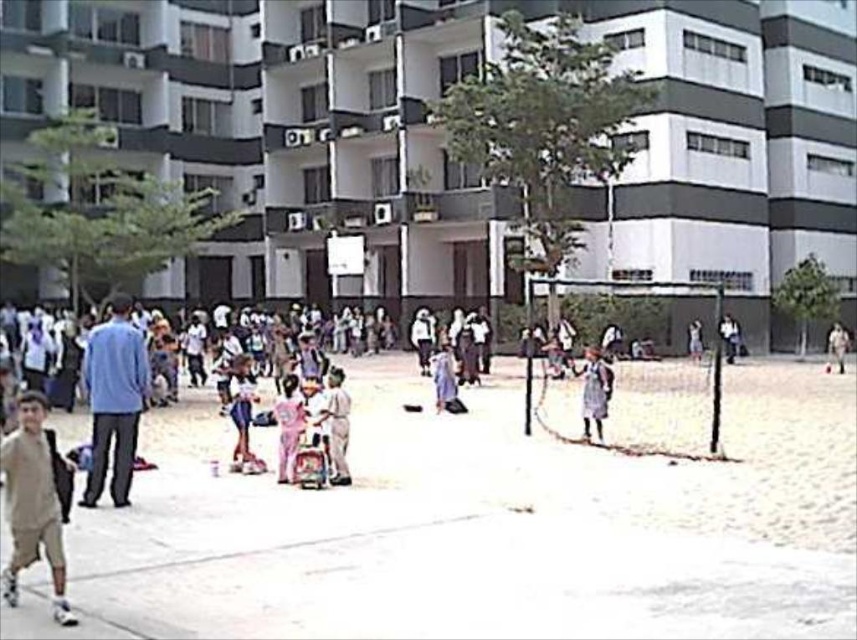
Which is below, blue cotton shirt at left or light brown fabric dress at center?

blue cotton shirt at left is lower down.

Does blue cotton shirt at left appear on the right side of light brown fabric dress at center?

No, blue cotton shirt at left is not to the right of light brown fabric dress at center.

Where is `blue cotton shirt at left`? The height and width of the screenshot is (640, 857). blue cotton shirt at left is located at coordinates tap(114, 400).

I want to click on blue cotton shirt at left, so click(x=114, y=400).

Is light gray concrete pavement at center bigger than blue cotton shirt at left?

Indeed, light gray concrete pavement at center has a larger size compared to blue cotton shirt at left.

Image resolution: width=857 pixels, height=640 pixels. What do you see at coordinates (477, 525) in the screenshot?
I see `light gray concrete pavement at center` at bounding box center [477, 525].

Which is in front, point (429, 419) or point (112, 461)?

Point (112, 461) is more forward.

Find the location of a particular element. This screenshot has height=640, width=857. light gray concrete pavement at center is located at coordinates (477, 525).

Is point (25, 476) positioned behind point (826, 349)?

No, (25, 476) is in front of (826, 349).

Who is taller, beige cotton shorts at lower left or white matte person at center-right?

white matte person at center-right is taller.

Locate an element on the screen. beige cotton shorts at lower left is located at coordinates (33, 502).